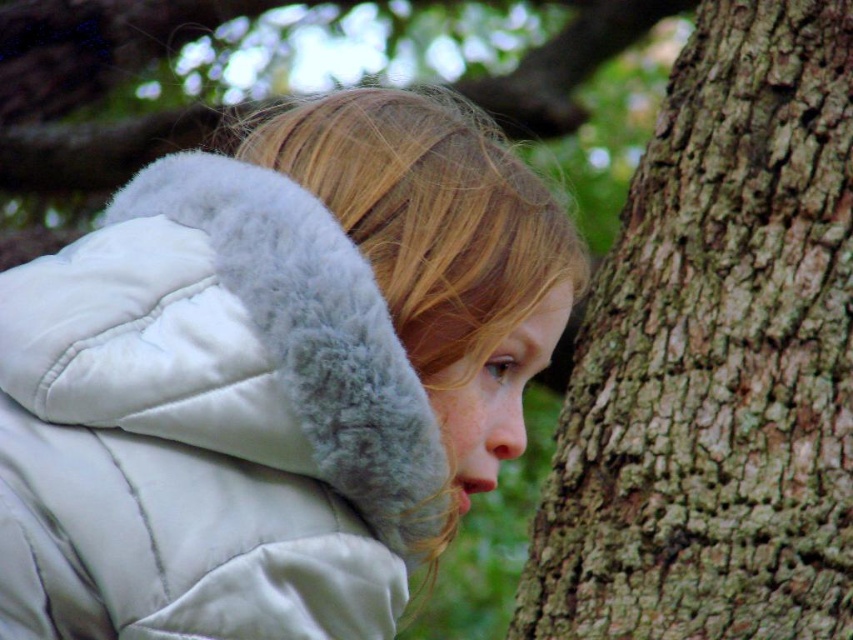
You are a photographer trying to capture the perfect shot of the white puffy jacket at center. The camera you are using has a focal point grid divided into 9 equal squares. If the grid is divided into 3 rows and 3 columns, which grid square should you aim at to ensure the jacket is centered in your photo?

The white puffy jacket at center is positioned at coordinates point (x=274, y=376). Since the grid has 3 rows and 3 columns, the center grid square would be the middle row and middle column. The coordinates 0.589 on the x and 0.322 on the y place it in the middle column and lower third row, so the correct grid square is the middle one on the bottom row.

You are a photographer trying to capture the entire white puffy jacket at center and brown rough bark at right in a single shot. Based on their sizes, will you need to zoom out your camera lens to include both?

The white puffy jacket at center is not as tall as brown rough bark at right, so you will need to zoom out your camera lens to include both in the frame.